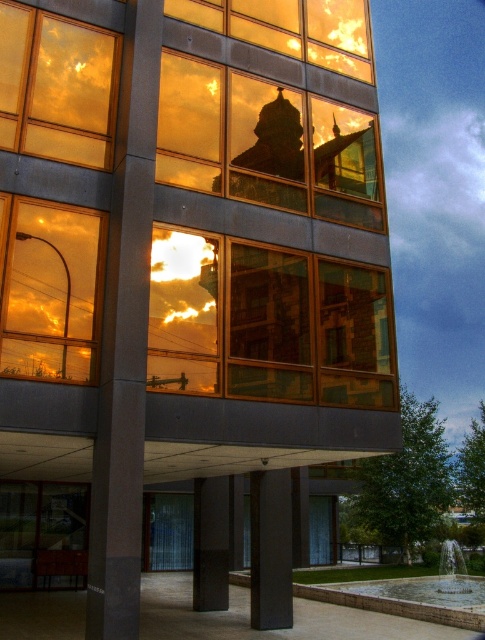
Question: Which point is farther to the camera?

Choices:
 (A) (13, 556)
 (B) (188, 536)
 (C) (23, 314)
 (D) (317, 586)

Answer: (B)

Question: Does matte glass window at upper left appear over clear glass window at lower left?

Choices:
 (A) no
 (B) yes

Answer: (B)

Question: Is golden reflective glass window at left wider than smooth concrete fountain at lower center?

Choices:
 (A) no
 (B) yes

Answer: (A)

Question: Can you confirm if smooth concrete fountain at lower center is wider than transparent glass door at lower center?

Choices:
 (A) yes
 (B) no

Answer: (A)

Question: Which object appears farthest from the camera in this image?

Choices:
 (A) smooth concrete fountain at lower center
 (B) clear glass window at lower left
 (C) transparent glass door at lower center
 (D) golden reflective glass window at left

Answer: (C)

Question: Which object is farther from the camera taking this photo?

Choices:
 (A) matte glass window at upper left
 (B) smooth concrete fountain at lower center

Answer: (B)